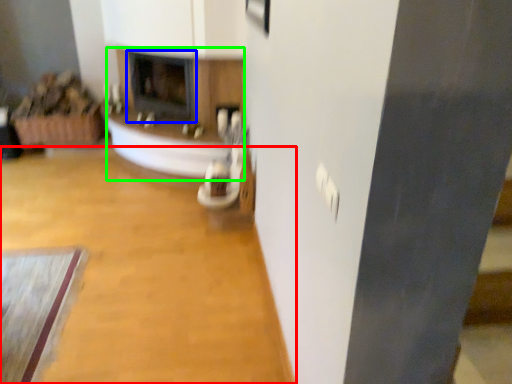
Question: Which object is the closest to the plain (highlighted by a red box)? Choose among these: fireplace (highlighted by a blue box) or fireplace (highlighted by a green box).

Choices:
 (A) fireplace
 (B) fireplace

Answer: (B)